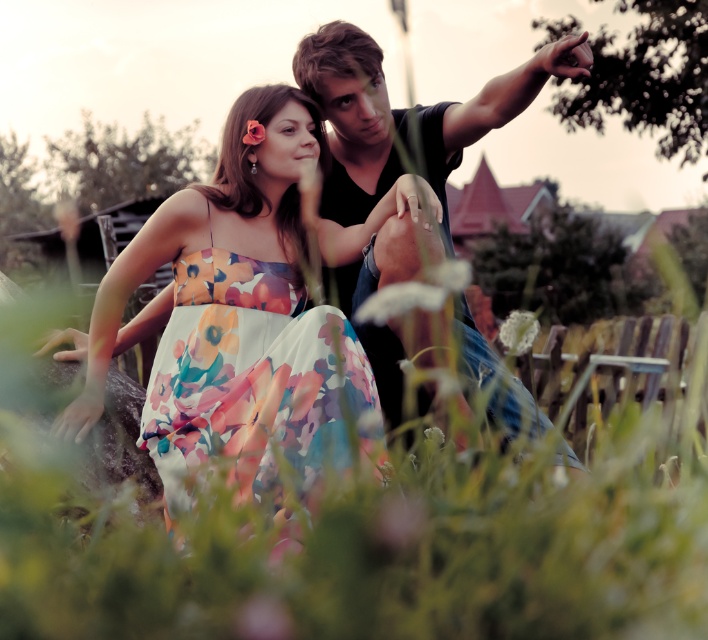
Does point (296, 541) come behind point (531, 326)?

No, (296, 541) is closer to viewer.

Is floral print dress at center taller than white matte flower at lower center?

Indeed, floral print dress at center has a greater height compared to white matte flower at lower center.

Is point (314, 356) positioned in front of point (523, 340)?

Yes, point (314, 356) is closer to viewer.

Where is `floral print dress at center`? This screenshot has height=640, width=708. floral print dress at center is located at coordinates (244, 310).

Can you confirm if floral silk dress at center is smaller than white matte flower at lower center?

No.

Does point (188, 400) come behind point (531, 326)?

No, it is in front of (531, 326).

Does point (282, 364) lie in front of point (535, 330)?

Yes, point (282, 364) is in front of point (535, 330).

Find the location of a particular element. The image size is (708, 640). floral silk dress at center is located at coordinates (251, 380).

Is green grass at lower center thinner than white matte flower at center?

Incorrect, green grass at lower center's width is not less than white matte flower at center's.

Can you confirm if green grass at lower center is shorter than white matte flower at center?

No, green grass at lower center is not shorter than white matte flower at center.

Measure the distance between point [607,456] and camera.

Point [607,456] is 4.87 meters from camera.

I want to click on green grass at lower center, so click(350, 541).